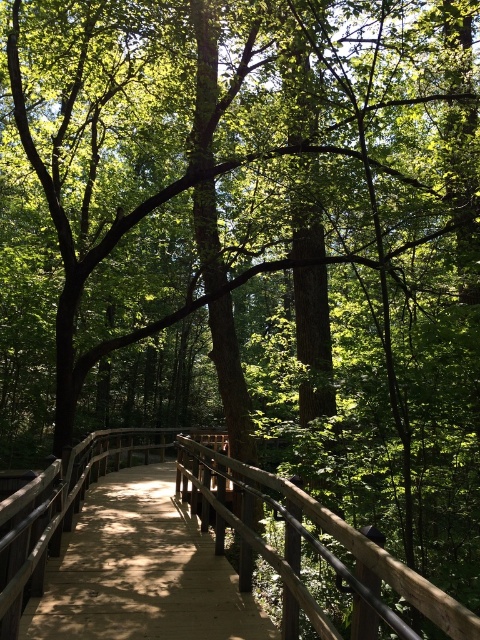
Question: Which point is closer to the camera taking this photo?

Choices:
 (A) (321, 609)
 (B) (113, 566)

Answer: (A)

Question: Among these points, which one is nearest to the camera?

Choices:
 (A) (127, 433)
 (B) (120, 477)

Answer: (B)

Question: Does wooden bridge at center appear on the left side of brown wooden bridge at center?

Choices:
 (A) no
 (B) yes

Answer: (A)

Question: Is wooden bridge at center thinner than brown wooden bridge at center?

Choices:
 (A) no
 (B) yes

Answer: (B)

Question: In this image, where is wooden bridge at center located relative to brown wooden bridge at center?

Choices:
 (A) right
 (B) left

Answer: (A)

Question: Which point is farther to the camera?

Choices:
 (A) brown wooden bridge at center
 (B) wooden bridge at center

Answer: (B)